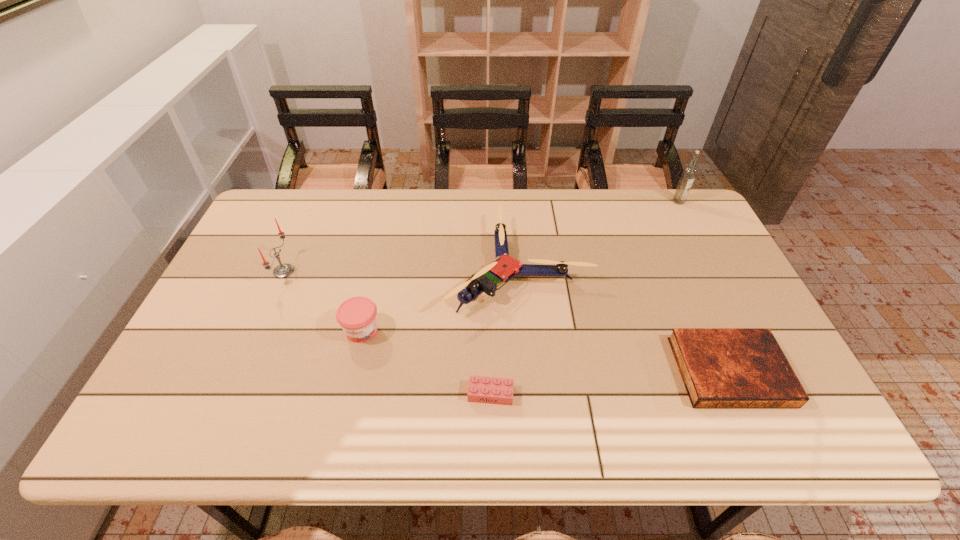
The width and height of the screenshot is (960, 540). Find the location of `vacant space located on the left of the drone`. vacant space located on the left of the drone is located at coordinates (421, 266).

Identify the location of vacant space located 0.160m on the front label of the second object from left to right. The width and height of the screenshot is (960, 540). (345, 404).

Locate an element on the screen. Image resolution: width=960 pixels, height=540 pixels. vacant space situated 0.380m on the left of the Lego is located at coordinates (304, 394).

Image resolution: width=960 pixels, height=540 pixels. I want to click on vodka located at the far edge, so click(x=688, y=175).

Locate an element on the screen. drone that is at the far edge is located at coordinates (504, 267).

The width and height of the screenshot is (960, 540). In order to click on object that is at the near edge in this screenshot , I will do `click(720, 367)`.

In order to click on object positioned at the left edge in this screenshot , I will do `click(284, 270)`.

You are a GUI agent. You are given a task and a screenshot of the screen. Output one action in this format:
    pyautogui.click(x=<x>, y=<y>)
    Task: Click on the vodka that is at the right edge
    The width and height of the screenshot is (960, 540).
    Given the screenshot: What is the action you would take?
    pyautogui.click(x=688, y=175)

Where is `Bible present at the right edge`? This screenshot has width=960, height=540. Bible present at the right edge is located at coordinates (720, 367).

The image size is (960, 540). What are the coordinates of `object located in the far right corner section of the desktop` in the screenshot? It's located at (688, 175).